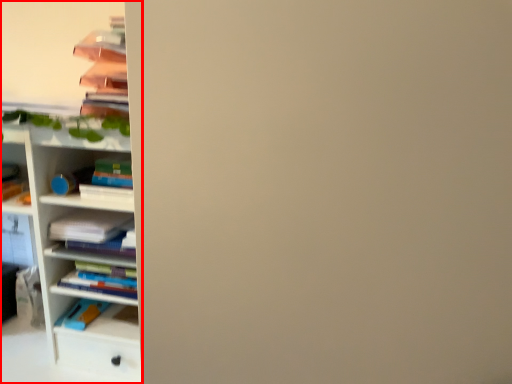
Question: From the image's perspective, considering the relative positions of shelf (annotated by the red box) and book in the image provided, where is shelf (annotated by the red box) located with respect to the staircase?

Choices:
 (A) above
 (B) below

Answer: (A)